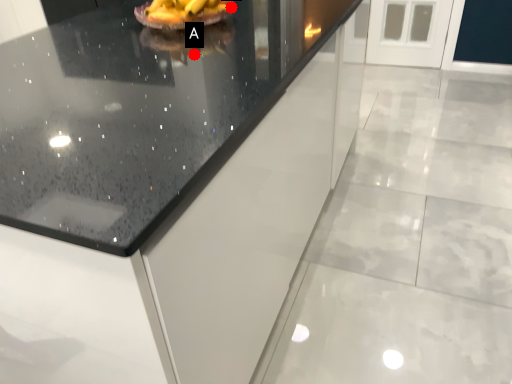
Question: Two points are circled on the image, labeled by A and B beside each circle. Which point appears closest to the camera in this image?

Choices:
 (A) A is closer
 (B) B is closer

Answer: (A)